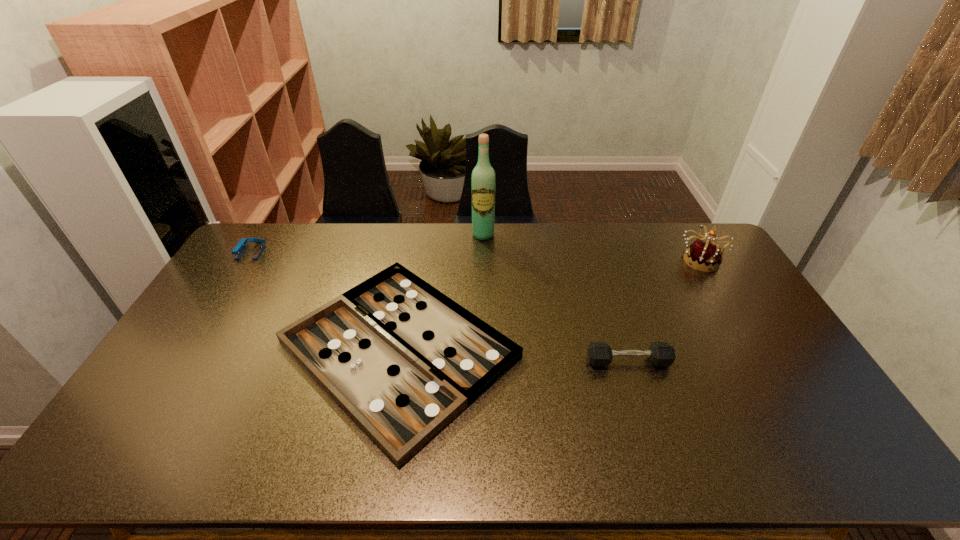
Locate an element on the screen. free location located 0.200m on the right of the stapler is located at coordinates (316, 252).

The image size is (960, 540). I want to click on vacant point located on the left of the second object from right to left, so click(x=517, y=361).

Image resolution: width=960 pixels, height=540 pixels. Identify the location of free space located 0.270m on the back of the gameboard. (420, 227).

You are a GUI agent. You are given a task and a screenshot of the screen. Output one action in this format:
    pyautogui.click(x=<x>, y=<y>)
    Task: Click on the wine bottle that is at the far edge
    The height and width of the screenshot is (540, 960).
    Given the screenshot: What is the action you would take?
    pyautogui.click(x=483, y=181)

The image size is (960, 540). I want to click on tiara located at the far edge, so click(705, 255).

Find the location of `stapler that is at the far edge`. stapler that is at the far edge is located at coordinates (238, 250).

Locate an element on the screen. This screenshot has width=960, height=540. object that is positioned at the near edge is located at coordinates (402, 359).

Locate an element on the screen. object located in the left edge section of the desktop is located at coordinates (238, 250).

Identify the location of object positioned at the right edge. This screenshot has height=540, width=960. (705, 255).

I want to click on object at the far left corner, so click(x=238, y=250).